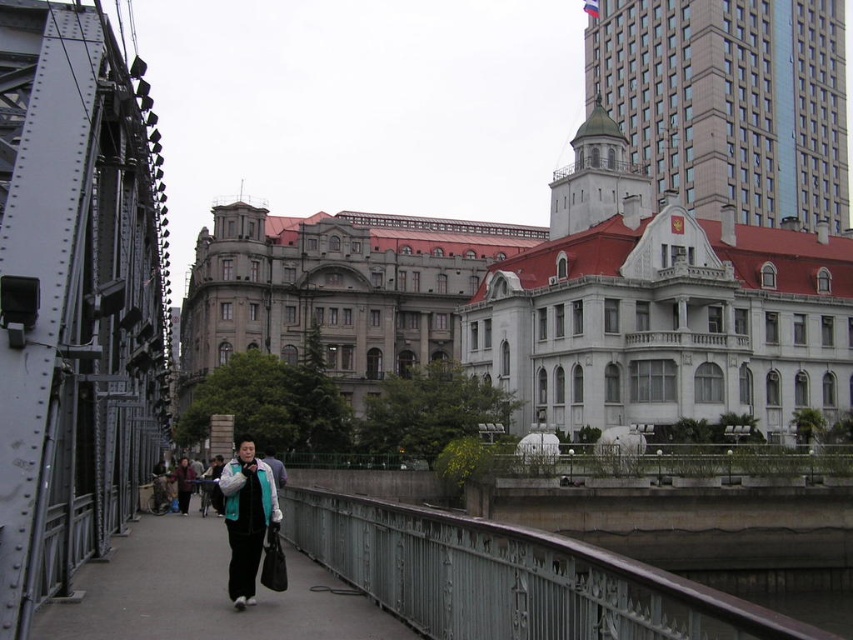
Which is above, black fabric bag at center or teal fabric jacket at center?

teal fabric jacket at center

Is black fabric bag at center closer to the viewer compared to teal fabric jacket at center?

Yes, black fabric bag at center is closer to the viewer.

Is point (196, 518) farther from viewer compared to point (248, 449)?

Yes.

The image size is (853, 640). What are the coordinates of `black fabric bag at center` in the screenshot? It's located at (204, 595).

Can you confirm if black fabric bag at center is smaller than black leather jacket at center?

Actually, black fabric bag at center might be larger than black leather jacket at center.

Is point (131, 611) positioned in front of point (186, 497)?

Yes.

You are a GUI agent. You are given a task and a screenshot of the screen. Output one action in this format:
    pyautogui.click(x=<x>, y=<y>)
    Task: Click on the black fabric bag at center
    The width and height of the screenshot is (853, 640).
    Given the screenshot: What is the action you would take?
    pyautogui.click(x=204, y=595)

Can you confirm if metallic gray pedestrian bridge at center is positioned below black fabric bag at center?

Indeed, metallic gray pedestrian bridge at center is positioned under black fabric bag at center.

The height and width of the screenshot is (640, 853). In order to click on metallic gray pedestrian bridge at center in this screenshot , I will do `click(509, 577)`.

In the scene shown: Who is more forward, (424, 528) or (93, 566)?

Point (424, 528) is more forward.

What are the coordinates of `metallic gray pedestrian bridge at center` in the screenshot? It's located at (509, 577).